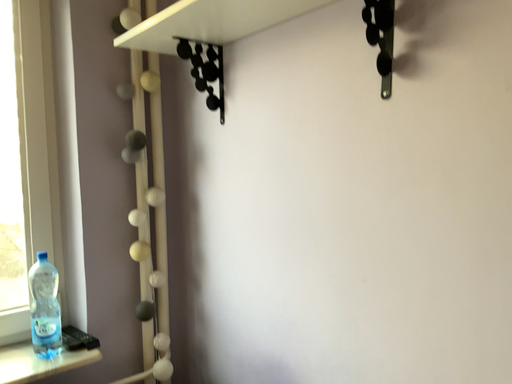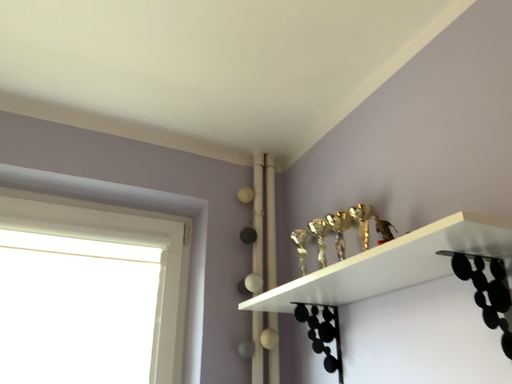
Question: Which way did the camera rotate in the video?

Choices:
 (A) rotated upward
 (B) rotated downward

Answer: (A)